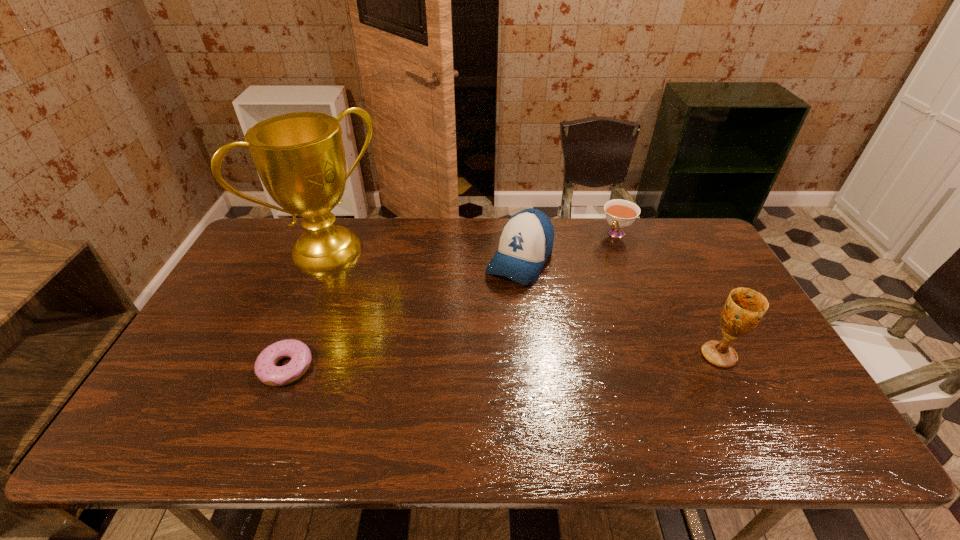
In order to click on object that is the third closest to the third tallest object in this screenshot , I will do `click(744, 308)`.

You are a GUI agent. You are given a task and a screenshot of the screen. Output one action in this format:
    pyautogui.click(x=<x>, y=<y>)
    Task: Click on the object that stands as the second closest to the award
    This screenshot has width=960, height=540.
    Given the screenshot: What is the action you would take?
    pyautogui.click(x=526, y=241)

Locate an element on the screen. This screenshot has height=540, width=960. vacant space that satisfies the following two spatial constraints: 1. on the front side of the tallest object; 2. on the right side of the third object from right to left is located at coordinates pyautogui.click(x=325, y=260).

This screenshot has height=540, width=960. Identify the location of vacant point that satisfies the following two spatial constraints: 1. on the front side of the rightmost object; 2. on the left side of the third tallest object. (530, 355).

I want to click on free space that satisfies the following two spatial constraints: 1. on the front side of the doughnut; 2. on the left side of the award, so point(281,367).

At what (x,y) coordinates should I click in order to perform the action: click on vacant position in the image that satisfies the following two spatial constraints: 1. on the back side of the doughnut; 2. on the right side of the second shortest object. Please return your answer as a coordinate pair (x, y). Looking at the image, I should click on (339, 233).